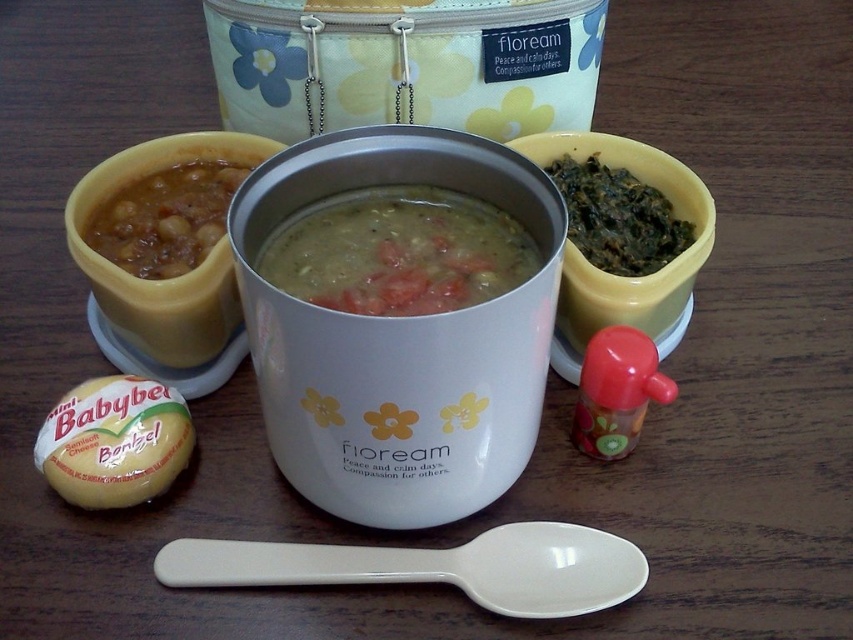
Question: Which object is farther from the camera taking this photo?

Choices:
 (A) green leafy vegetable at upper right
 (B) white plastic spoon at lower center
 (C) green matte soup at center
 (D) brown matte beans at left

Answer: (A)

Question: Is green matte soup at center below yellow cheese at lower left?

Choices:
 (A) no
 (B) yes

Answer: (A)

Question: Which of the following is the closest to the observer?

Choices:
 (A) (422, 305)
 (B) (131, 497)
 (C) (560, 600)
 (D) (184, 220)

Answer: (A)

Question: Is white plastic spoon at lower center further to camera compared to brown matte beans at left?

Choices:
 (A) no
 (B) yes

Answer: (A)

Question: Which is farther from the white plastic spoon at lower center?

Choices:
 (A) green matte soup at center
 (B) brown matte beans at left
 (C) green leafy vegetable at upper right
 (D) yellow cheese at lower left

Answer: (B)

Question: Does white plastic spoon at lower center appear under green leafy vegetable at upper right?

Choices:
 (A) yes
 (B) no

Answer: (A)